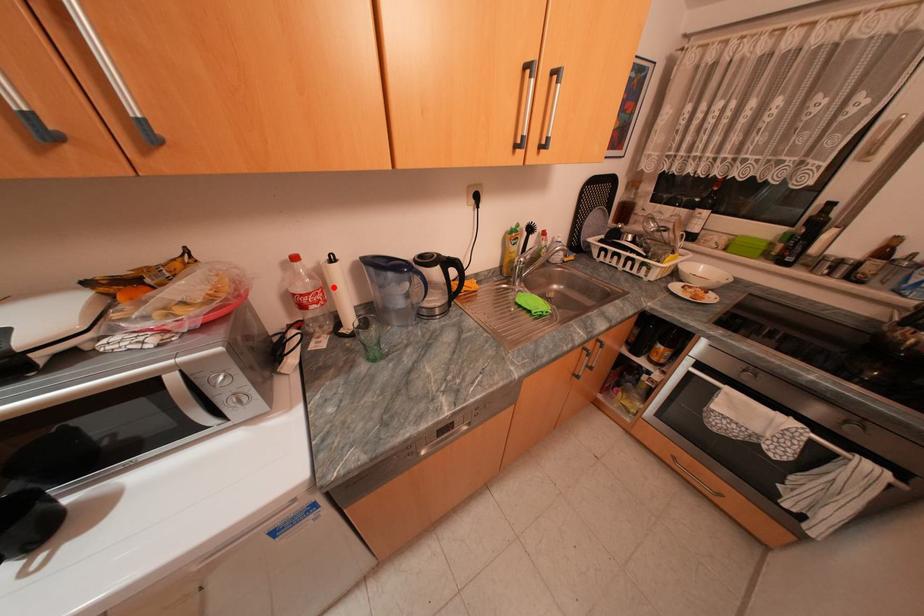
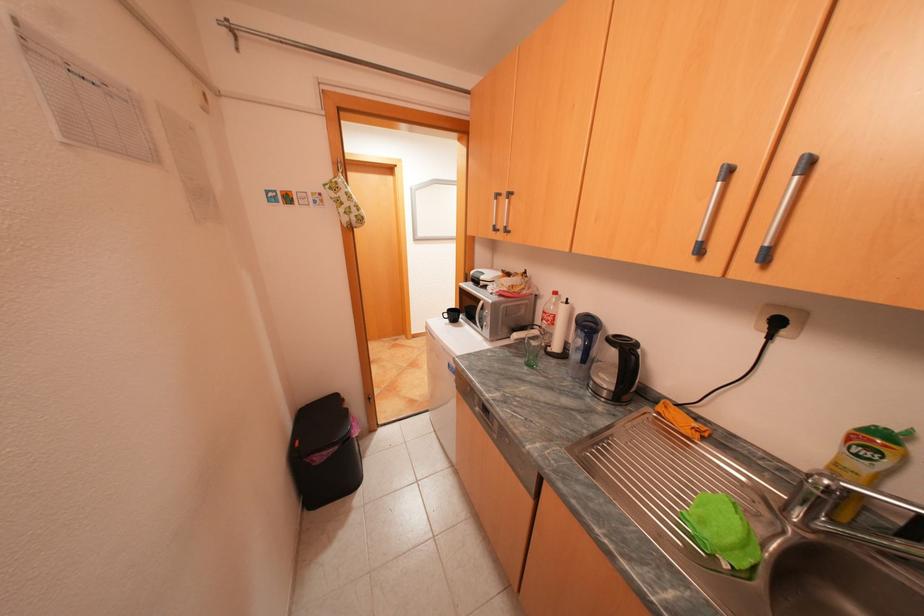
In the second image, find the point that corresponds to the highlighted location in the first image.

(565, 315)